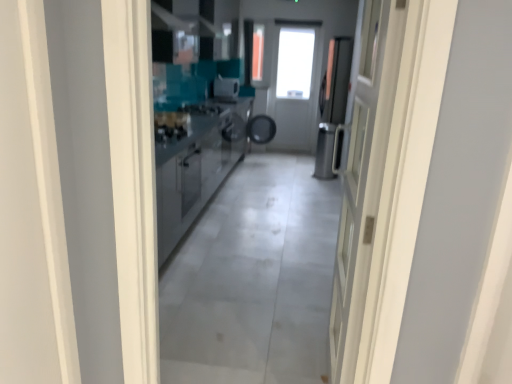
What is the approximate width of satin silver dishwasher at center?

satin silver dishwasher at center is 26.24 centimeters wide.

Locate an element on the screen. Image resolution: width=512 pixels, height=384 pixels. satin silver toaster at center is located at coordinates (226, 89).

How many degrees apart are the facing directions of satin silver toaster at center and satin silver dishwasher at center?

There is a 179-degree angle between the facing directions of satin silver toaster at center and satin silver dishwasher at center.

Which is more to the right, satin silver toaster at center or satin silver dishwasher at center?

From the viewer's perspective, satin silver dishwasher at center appears more on the right side.

Consider the image. From the image's perspective, is satin silver toaster at center on satin silver dishwasher at center?

Correct, satin silver toaster at center appears higher than satin silver dishwasher at center in the image.

Does satin silver toaster at center come in front of satin silver dishwasher at center?

That is False.

In the image, is satin silver dishwasher at center on the left side or the right side of white glossy door at right?

In the image, satin silver dishwasher at center appears on the right side of white glossy door at right.

Is satin silver dishwasher at center smaller than white glossy door at right?

Indeed, satin silver dishwasher at center has a smaller size compared to white glossy door at right.

Is satin silver dishwasher at center in front of or behind white glossy door at right in the image?

In the image, satin silver dishwasher at center appears behind white glossy door at right.

Considering the relative sizes of satin silver dishwasher at center and white glossy door at right in the image provided, is satin silver dishwasher at center wider than white glossy door at right?

Yes, satin silver dishwasher at center is wider than white glossy door at right.

From a real-world perspective, which is physically above, stainless steel cabinetry at center or white glossy door at right?

white glossy door at right.

Is stainless steel cabinetry at center far from white glossy door at right?

Indeed, stainless steel cabinetry at center is not near white glossy door at right.

Considering the sizes of objects stainless steel cabinetry at center and white glossy door at right in the image provided, who is shorter, stainless steel cabinetry at center or white glossy door at right?

stainless steel cabinetry at center.

Which of these two, white glossy door at right or stainless steel cabinetry at center, stands shorter?

With less height is stainless steel cabinetry at center.

Considering the relative sizes of white glossy door at right and stainless steel cabinetry at center in the image provided, is white glossy door at right wider than stainless steel cabinetry at center?

No.

Does point (353, 130) come closer to viewer compared to point (204, 177)?

Yes, point (353, 130) is in front of point (204, 177).

Is white glossy door at right positioned behind stainless steel cabinetry at center?

That is False.

Do you think satin silver dishwasher at center is within satin silver toaster at center, or outside of it?

satin silver dishwasher at center is not inside satin silver toaster at center, it's outside.

Is satin silver dishwasher at center far away from satin silver toaster at center?

Yes, satin silver dishwasher at center and satin silver toaster at center are quite far apart.

Between satin silver dishwasher at center and satin silver toaster at center, which one has smaller size?

satin silver toaster at center.

In the image, is satin silver dishwasher at center on the left side or the right side of satin silver toaster at center?

Based on their positions, satin silver dishwasher at center is located to the right of satin silver toaster at center.

From the image's perspective, relative to white glossy door at right, is satin silver toaster at center above or below?

Based on their image positions, satin silver toaster at center is located above white glossy door at right.

Is point (231, 91) positioned in front of point (358, 305)?

No, (231, 91) is further to viewer.

Is satin silver toaster at center inside or outside of white glossy door at right?

satin silver toaster at center is not enclosed by white glossy door at right.

Is white glossy door at right at the back of satin silver toaster at center?

No, satin silver toaster at center is not facing the opposite direction of white glossy door at right.

From the image's perspective, between satin silver toaster at center and stainless steel cabinetry at center, which one is located above?

From the image's view, satin silver toaster at center is above.

At what (x,y) coordinates should I click in order to perform the action: click on cabinetry on the left of satin silver toaster at center. Please return your answer as a coordinate pair (x, y). Looking at the image, I should click on (197, 168).

Is satin silver toaster at center bigger or smaller than stainless steel cabinetry at center?

In the image, satin silver toaster at center appears to be smaller than stainless steel cabinetry at center.

Which point is more forward, (237, 95) or (186, 161)?

The point (186, 161) is in front.

Locate an element on the screen. Image resolution: width=512 pixels, height=384 pixels. appliance positioned vertically above the satin silver dishwasher at center (from a real-world perspective) is located at coordinates (226, 89).

Where is `dish washer above the white glossy door at right (from the image's perspective)`? The image size is (512, 384). dish washer above the white glossy door at right (from the image's perspective) is located at coordinates (325, 151).

When comparing their distances from stainless steel cabinetry at center, does white glossy door at right or satin silver dishwasher at center seem closer?

white glossy door at right is positioned closer to the anchor stainless steel cabinetry at center.

Estimate the real-world distances between objects in this image. Which object is closer to satin silver dishwasher at center, stainless steel cabinetry at center or satin silver toaster at center?

Among the two, satin silver toaster at center is located nearer to satin silver dishwasher at center.

Which object lies nearer to the anchor point satin silver toaster at center, stainless steel cabinetry at center or white glossy door at right?

The object closer to satin silver toaster at center is stainless steel cabinetry at center.

Estimate the real-world distances between objects in this image. Which object is closer to satin silver dishwasher at center, satin silver toaster at center or stainless steel cabinetry at center?

satin silver toaster at center is closer to satin silver dishwasher at center.

From the image, which object appears to be farther from stainless steel cabinetry at center, satin silver toaster at center or satin silver dishwasher at center?

Among the two, satin silver dishwasher at center is located further to stainless steel cabinetry at center.

Which object lies further to the anchor point satin silver toaster at center, stainless steel cabinetry at center or satin silver dishwasher at center?

Based on the image, stainless steel cabinetry at center appears to be further to satin silver toaster at center.

Considering their positions, is stainless steel cabinetry at center positioned closer to satin silver dishwasher at center than white glossy door at right?

stainless steel cabinetry at center is positioned closer to the anchor satin silver dishwasher at center.

From the image, which object appears to be farther from satin silver toaster at center, satin silver dishwasher at center or white glossy door at right?

white glossy door at right lies further to satin silver toaster at center than the other object.

Where is `dish washer between white glossy door at right and satin silver toaster at center along the z-axis`? This screenshot has width=512, height=384. dish washer between white glossy door at right and satin silver toaster at center along the z-axis is located at coordinates (325, 151).

The width and height of the screenshot is (512, 384). Identify the location of dish washer between stainless steel cabinetry at center and satin silver toaster at center from front to back. (325, 151).

In order to click on cabinetry between white glossy door at right and satin silver toaster at center from front to back in this screenshot , I will do `click(197, 168)`.

Identify the location of cabinetry positioned between white glossy door at right and satin silver dishwasher at center from near to far. (197, 168).